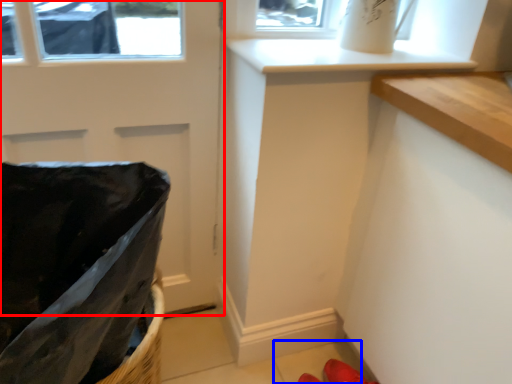
Question: Which of the following is the closest to the observer, door (highlighted by a red box) or tile (highlighted by a blue box)?

Choices:
 (A) door
 (B) tile

Answer: (A)